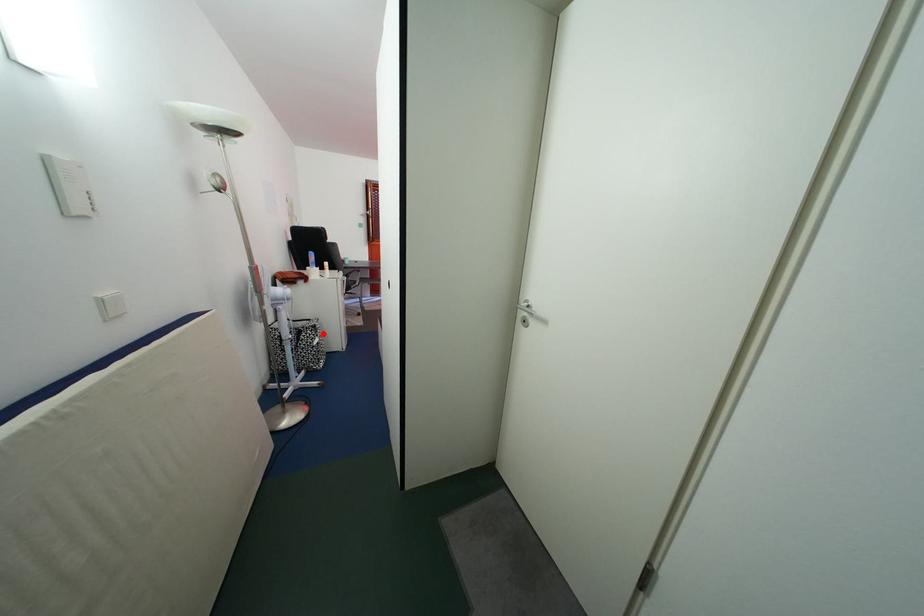
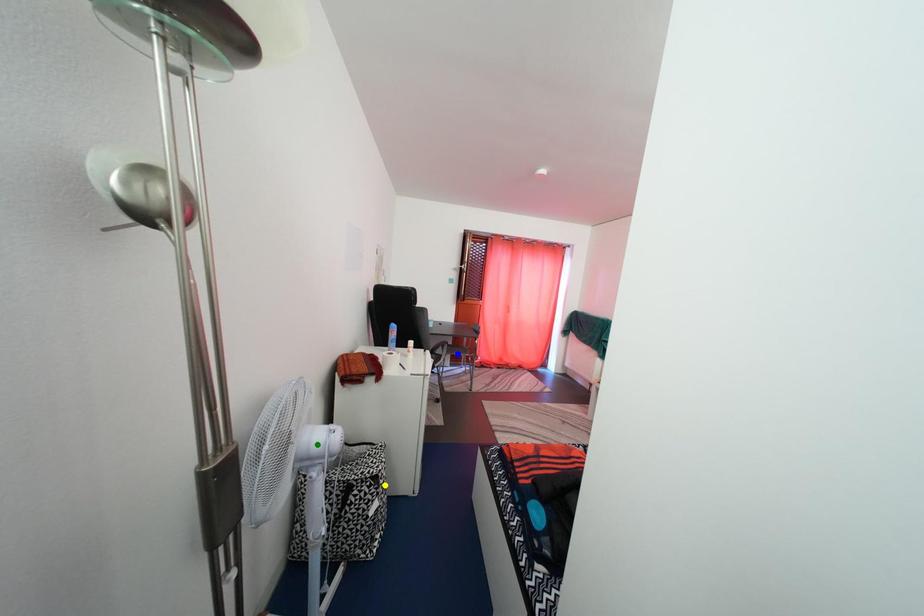
Question: I am providing you with two images of the same scene from different viewpoints. A red point is marked on the first image. You are given multiple points on the second image. Which point in image 2 represents the same 3d spot as the red point in image 1?

Choices:
 (A) blue point
 (B) green point
 (C) yellow point

Answer: (C)